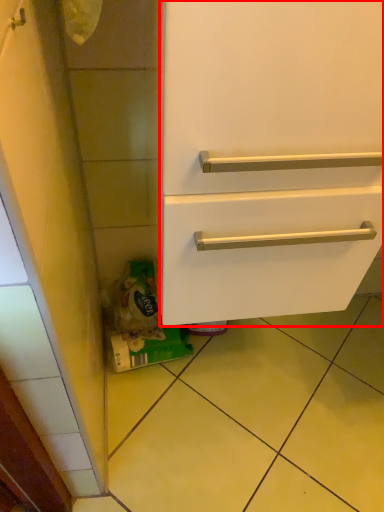
Question: From the image's perspective, what is the correct spatial positioning of drawer (annotated by the red box) in reference to tile?

Choices:
 (A) below
 (B) above

Answer: (B)